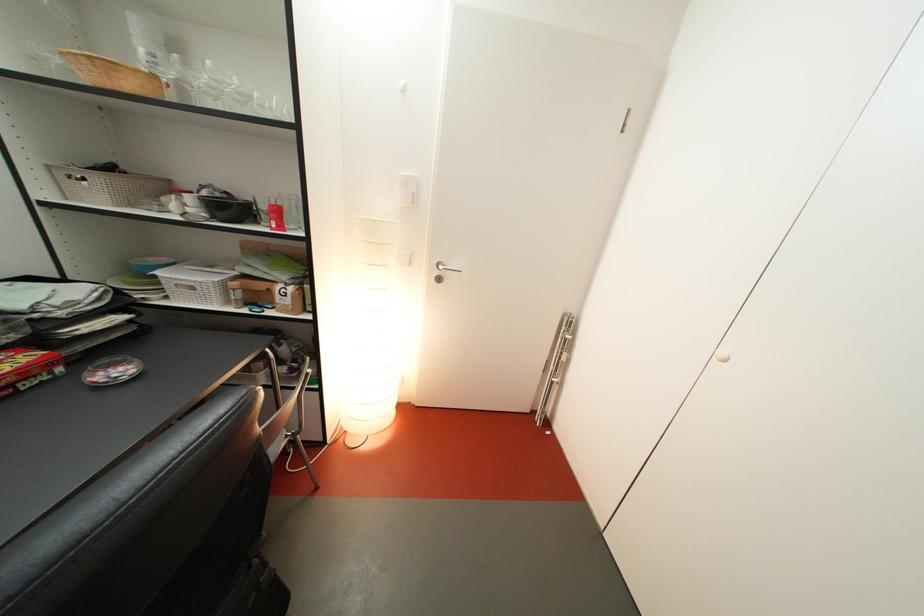
Locate an element on the screen. white light switch is located at coordinates (407, 188).